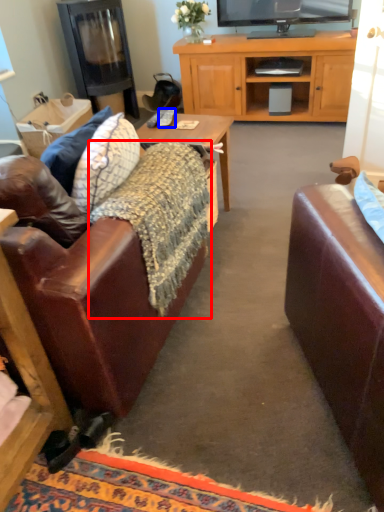
Question: Which of the following is the farthest to the observer, blanket (highlighted by a red box) or remote control (highlighted by a blue box)?

Choices:
 (A) blanket
 (B) remote control

Answer: (B)